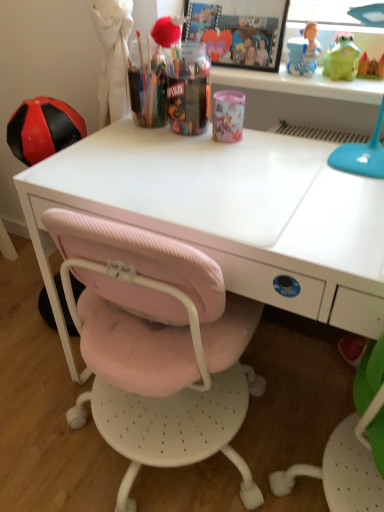
This screenshot has width=384, height=512. In order to click on free space in front of translucent plastic container at center, arranged as the 1th stationery when viewed from the left in this screenshot , I will do `click(187, 155)`.